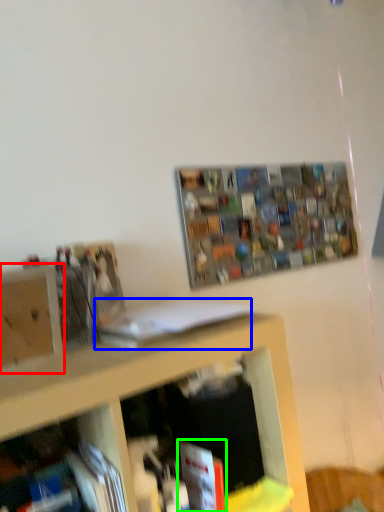
Question: Which object is the farthest from cabinet (highlighted by a red box)? Choose among these: book (highlighted by a blue box) or book (highlighted by a green box).

Choices:
 (A) book
 (B) book

Answer: (B)